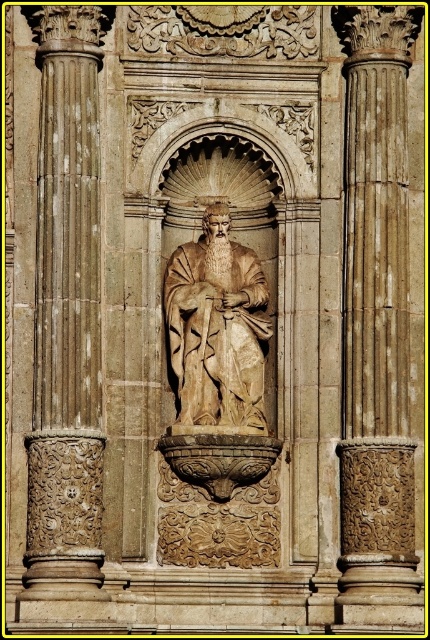
Question: Considering the real-world distances, which object is closest to the beige stone statue at center?

Choices:
 (A) carved stone column at center
 (B) beige stone column at center

Answer: (B)

Question: Which point is farther to the camera?

Choices:
 (A) (206, 300)
 (B) (86, 170)

Answer: (A)

Question: Considering the relative positions of beige stone column at center and beige stone statue at center in the image provided, where is beige stone column at center located with respect to beige stone statue at center?

Choices:
 (A) below
 (B) above

Answer: (A)

Question: Does carved stone column at center lie behind beige stone statue at center?

Choices:
 (A) yes
 (B) no

Answer: (B)

Question: Which point is closer to the camera taking this photo?

Choices:
 (A) (183, 289)
 (B) (356, 388)
 (C) (55, 428)

Answer: (C)

Question: Does beige stone column at center appear on the right side of beige stone statue at center?

Choices:
 (A) no
 (B) yes

Answer: (B)